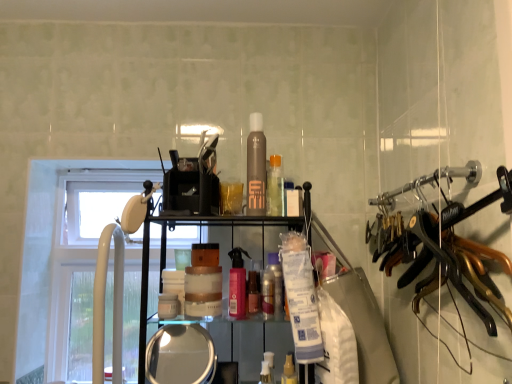
Locate an element on the screen. translucent plastic spray bottle at center, placed as the fifth toiletry when sorted from right to left is located at coordinates (254, 289).

At what (x,y) coordinates should I click in order to perform the action: click on clear glass mirror at lower center. Please return your answer as a coordinate pair (x, y). Image resolution: width=512 pixels, height=384 pixels. Looking at the image, I should click on (180, 355).

How much space does pink matte spray bottle at center, which is the sixth toiletry from right to left, occupy horizontally?

2.43 inches.

What do you see at coordinates (203, 281) in the screenshot? This screenshot has width=512, height=384. I see `matte gold jar at center, the 7th toiletry positioned from the right` at bounding box center [203, 281].

What do you see at coordinates (292, 200) in the screenshot? The image size is (512, 384). I see `white matte bottle at center, arranged as the 1th toiletry when viewed from the right` at bounding box center [292, 200].

The height and width of the screenshot is (384, 512). What are the coordinates of `translucent plastic spray bottle at center, the third toiletry in the left-to-right sequence` in the screenshot? It's located at (254, 289).

In the image, is translucent plastic spray bottle at center, placed as the fifth toiletry when sorted from right to left, positioned in front of or behind translucent plastic spray bottle at center, positioned as the sixth toiletry in left-to-right order?

translucent plastic spray bottle at center, placed as the fifth toiletry when sorted from right to left, is behind translucent plastic spray bottle at center, positioned as the sixth toiletry in left-to-right order.

Is translucent plastic spray bottle at center, placed as the fifth toiletry when sorted from right to left, positioned with its back to translucent plastic spray bottle at center, positioned as the sixth toiletry in left-to-right order?

No.

Is translucent plastic spray bottle at center, placed as the fifth toiletry when sorted from right to left, placed right next to translucent plastic spray bottle at center, positioned as the sixth toiletry in left-to-right order?

There is a gap between translucent plastic spray bottle at center, placed as the fifth toiletry when sorted from right to left, and translucent plastic spray bottle at center, positioned as the sixth toiletry in left-to-right order.

Measure the distance between translucent plastic spray bottle at center, placed as the fifth toiletry when sorted from right to left, and translucent plastic spray bottle at center, positioned as the sixth toiletry in left-to-right order.

translucent plastic spray bottle at center, placed as the fifth toiletry when sorted from right to left, and translucent plastic spray bottle at center, positioned as the sixth toiletry in left-to-right order, are 7.00 inches apart.

Locate an element on the screen. the 4th toiletry above the matte gold jar at center, the 7th toiletry positioned from the right (from the image's perspective) is located at coordinates (275, 187).

Considering the sizes of translucent plastic bottle at center, the fifth toiletry viewed from the left, and matte gold jar at center, positioned as the 1th toiletry in left-to-right order, in the image, is translucent plastic bottle at center, the fifth toiletry viewed from the left, wider or thinner than matte gold jar at center, positioned as the 1th toiletry in left-to-right order,?

translucent plastic bottle at center, the fifth toiletry viewed from the left, is thinner than matte gold jar at center, positioned as the 1th toiletry in left-to-right order.

Based on the photo, from the image's perspective, is translucent plastic bottle at center, the fifth toiletry viewed from the left, located above matte gold jar at center, the 7th toiletry positioned from the right?

Correct, translucent plastic bottle at center, the fifth toiletry viewed from the left, appears higher than matte gold jar at center, the 7th toiletry positioned from the right, in the image.

Is the position of translucent plastic bottle at center, which is counted as the third toiletry, starting from the right, more distant than that of brown matte hair spray at center, the fourth toiletry when ordered from left to right?

Yes, translucent plastic bottle at center, which is counted as the third toiletry, starting from the right, is behind brown matte hair spray at center, the fourth toiletry when ordered from left to right.

Is translucent plastic bottle at center, the fifth toiletry viewed from the left, turned away from brown matte hair spray at center, the 4th toiletry when ordered from right to left?

No, translucent plastic bottle at center, the fifth toiletry viewed from the left,'s orientation is not away from brown matte hair spray at center, the 4th toiletry when ordered from right to left.

Would you consider translucent plastic bottle at center, the fifth toiletry viewed from the left, to be distant from brown matte hair spray at center, the fourth toiletry when ordered from left to right?

That's not correct — translucent plastic bottle at center, the fifth toiletry viewed from the left, is a little close to brown matte hair spray at center, the fourth toiletry when ordered from left to right.

Based on their positions, is translucent plastic bottle at center, which is counted as the third toiletry, starting from the right, located to the left or right of brown matte hair spray at center, the fourth toiletry when ordered from left to right?

In the image, translucent plastic bottle at center, which is counted as the third toiletry, starting from the right, appears on the right side of brown matte hair spray at center, the fourth toiletry when ordered from left to right.

Based on the photo, which object is wider, white plastic faucet at left or translucent plastic spray bottle at center, positioned as the sixth toiletry in left-to-right order?

white plastic faucet at left is wider.

At what (x,y) coordinates should I click in order to perform the action: click on the 6th toiletry to the right of the white plastic faucet at left, counting from the anchor's position. Please return your answer as a coordinate pair (x, y). The width and height of the screenshot is (512, 384). Looking at the image, I should click on (289, 371).

Is white plastic faucet at left looking in the opposite direction of translucent plastic spray bottle at center, positioned as the sixth toiletry in left-to-right order?

No, white plastic faucet at left is not facing away from translucent plastic spray bottle at center, positioned as the sixth toiletry in left-to-right order.

How many degrees apart are the facing directions of white plastic faucet at left and translucent plastic spray bottle at center, which is the second toiletry from right to left?

The angular difference between white plastic faucet at left and translucent plastic spray bottle at center, which is the second toiletry from right to left, is 11.3 degrees.

This screenshot has height=384, width=512. Find the location of `window above the translucent plastic spray bottle at center, which is the second toiletry from right to left (from a real-world perspective)`. window above the translucent plastic spray bottle at center, which is the second toiletry from right to left (from a real-world perspective) is located at coordinates (67, 259).

Considering the relative sizes of white plastic window at left and translucent plastic spray bottle at center, which is the second toiletry from right to left, in the image provided, is white plastic window at left taller than translucent plastic spray bottle at center, which is the second toiletry from right to left,?

Yes, white plastic window at left is taller than translucent plastic spray bottle at center, which is the second toiletry from right to left.

Are white plastic window at left and translucent plastic spray bottle at center, positioned as the sixth toiletry in left-to-right order, beside each other?

No, white plastic window at left is not in contact with translucent plastic spray bottle at center, positioned as the sixth toiletry in left-to-right order.

Which point is more distant from viewer, (133,369) or (288,381)?

The point (133,369) is farther from the camera.

Based on their positions, is brown matte hair spray at center, the 4th toiletry when ordered from right to left, located to the left or right of translucent plastic bottle at center, the fifth toiletry viewed from the left?

Clearly, brown matte hair spray at center, the 4th toiletry when ordered from right to left, is on the left of translucent plastic bottle at center, the fifth toiletry viewed from the left, in the image.

From the picture: Does brown matte hair spray at center, the 4th toiletry when ordered from right to left, have a lesser height compared to translucent plastic bottle at center, the fifth toiletry viewed from the left?

No, brown matte hair spray at center, the 4th toiletry when ordered from right to left, is not shorter than translucent plastic bottle at center, the fifth toiletry viewed from the left.

Looking at this image, which object is more forward, pink matte spray bottle at center, the 2th toiletry viewed from the left, or brown matte hair spray at center, the fourth toiletry when ordered from left to right?

Positioned in front is brown matte hair spray at center, the fourth toiletry when ordered from left to right.

Which is more distant, (244,279) or (259,175)?

The point (244,279) is farther.

Is brown matte hair spray at center, the 4th toiletry when ordered from right to left, inside pink matte spray bottle at center, which is the sixth toiletry from right to left?

No, brown matte hair spray at center, the 4th toiletry when ordered from right to left, is not inside pink matte spray bottle at center, which is the sixth toiletry from right to left.

Considering the relative sizes of pink matte spray bottle at center, which is the sixth toiletry from right to left, and brown matte hair spray at center, the 4th toiletry when ordered from right to left, in the image provided, is pink matte spray bottle at center, which is the sixth toiletry from right to left, taller than brown matte hair spray at center, the 4th toiletry when ordered from right to left,?

Incorrect, the height of pink matte spray bottle at center, which is the sixth toiletry from right to left, is not larger of that of brown matte hair spray at center, the 4th toiletry when ordered from right to left.

This screenshot has height=384, width=512. I want to click on toiletry that is the 2nd object located above the translucent plastic spray bottle at center, which is the second toiletry from right to left (from the image's perspective), so click(x=254, y=289).

Where is `the 5th toiletry behind the matte gold jar at center, positioned as the 1th toiletry in left-to-right order, counting from the anchor's position`? the 5th toiletry behind the matte gold jar at center, positioned as the 1th toiletry in left-to-right order, counting from the anchor's position is located at coordinates (275, 187).

From the image, which object appears to be farther from translucent plastic bottle at center, the fifth toiletry viewed from the left, pink matte spray bottle at center, the 2th toiletry viewed from the left, or white plastic window at left?

white plastic window at left is further to translucent plastic bottle at center, the fifth toiletry viewed from the left.

Considering their positions, is white plastic faucet at left positioned further to translucent plastic spray bottle at center, placed as the fifth toiletry when sorted from right to left, than pink matte spray bottle at center, which is the sixth toiletry from right to left?

The object further to translucent plastic spray bottle at center, placed as the fifth toiletry when sorted from right to left, is white plastic faucet at left.

Which object lies nearer to the anchor point pink matte spray bottle at center, the 2th toiletry viewed from the left, translucent plastic spray bottle at center, positioned as the sixth toiletry in left-to-right order, or translucent plastic bottle at center, which is counted as the third toiletry, starting from the right?

translucent plastic bottle at center, which is counted as the third toiletry, starting from the right.

Which object lies nearer to the anchor point white plastic window at left, white plastic faucet at left or translucent plastic spray bottle at center, positioned as the sixth toiletry in left-to-right order?

Among the two, white plastic faucet at left is located nearer to white plastic window at left.

From the image, which object appears to be farther from brown matte hair spray at center, the 4th toiletry when ordered from right to left, white matte bottle at center, arranged as the 1th toiletry when viewed from the right, or translucent plastic spray bottle at center, positioned as the sixth toiletry in left-to-right order?

Based on the image, translucent plastic spray bottle at center, positioned as the sixth toiletry in left-to-right order, appears to be further to brown matte hair spray at center, the 4th toiletry when ordered from right to left.

From the image, which object appears to be nearer to white matte bottle at center, which is the seventh toiletry in left-to-right order, pink matte spray bottle at center, the 2th toiletry viewed from the left, or translucent plastic spray bottle at center, which is the second toiletry from right to left?

Based on the image, pink matte spray bottle at center, the 2th toiletry viewed from the left, appears to be nearer to white matte bottle at center, which is the seventh toiletry in left-to-right order.

Considering their positions, is white plastic window at left positioned closer to metallic gold hangers at right than white plastic faucet at left?

Based on the image, white plastic faucet at left appears to be nearer to metallic gold hangers at right.

Based on their spatial positions, is translucent plastic spray bottle at center, the third toiletry in the left-to-right sequence, or brown matte hair spray at center, the fourth toiletry when ordered from left to right, further from white matte bottle at center, which is the seventh toiletry in left-to-right order?

The object further to white matte bottle at center, which is the seventh toiletry in left-to-right order, is translucent plastic spray bottle at center, the third toiletry in the left-to-right sequence.

At what (x,y) coordinates should I click in order to perform the action: click on faucet between white plastic window at left and translucent plastic spray bottle at center, the third toiletry in the left-to-right sequence, from left to right. Please return your answer as a coordinate pair (x, y). Looking at the image, I should click on (104, 304).

This screenshot has height=384, width=512. Find the location of `mirror between brown matte hair spray at center, the fourth toiletry when ordered from left to right, and translucent plastic spray bottle at center, positioned as the sixth toiletry in left-to-right order, from top to bottom`. mirror between brown matte hair spray at center, the fourth toiletry when ordered from left to right, and translucent plastic spray bottle at center, positioned as the sixth toiletry in left-to-right order, from top to bottom is located at coordinates (180, 355).

Where is `mirror located between white plastic faucet at left and translucent plastic spray bottle at center, positioned as the sixth toiletry in left-to-right order, in the left-right direction`? This screenshot has width=512, height=384. mirror located between white plastic faucet at left and translucent plastic spray bottle at center, positioned as the sixth toiletry in left-to-right order, in the left-right direction is located at coordinates (180, 355).

The height and width of the screenshot is (384, 512). Identify the location of toiletry between white matte bottle at center, arranged as the 1th toiletry when viewed from the right, and translucent plastic spray bottle at center, the third toiletry in the left-to-right sequence, in the up-down direction. click(x=237, y=284).